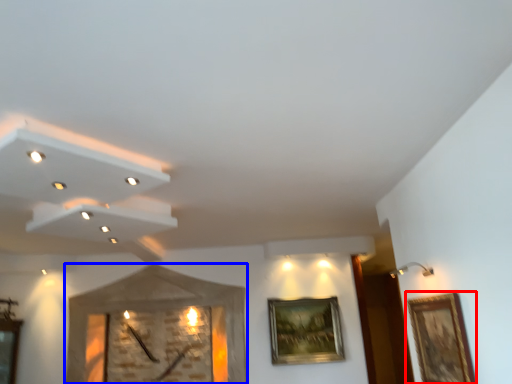
Question: Which point is further to the camera, picture frame (highlighted by a red box) or clock (highlighted by a blue box)?

Choices:
 (A) picture frame
 (B) clock

Answer: (B)